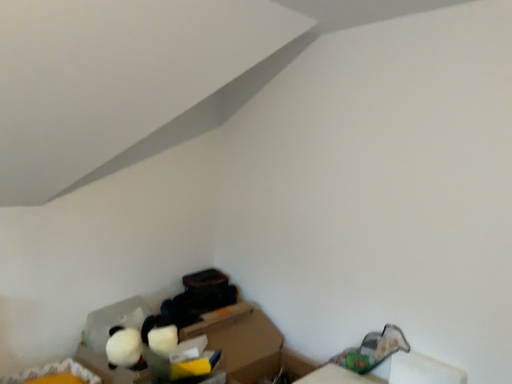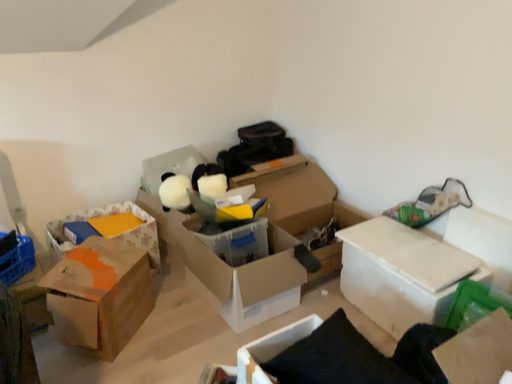
Question: Which way did the camera rotate in the video?

Choices:
 (A) rotated upward
 (B) rotated downward

Answer: (B)